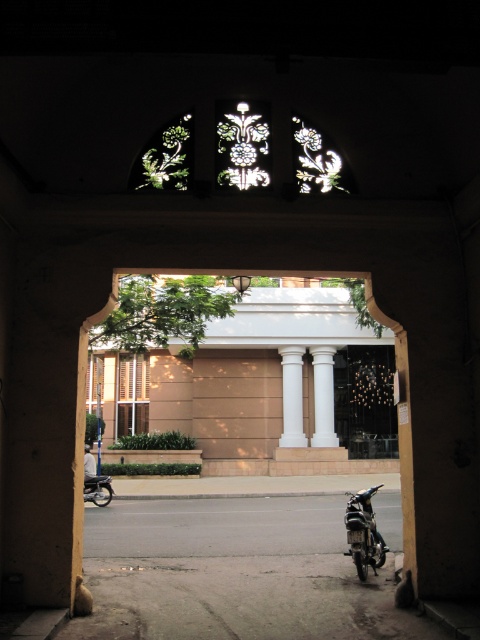
You are standing inside the arched doorway and want to walk towards the shiny black motorcycle at lower right and the shiny black motorcycle at lower left. Which motorcycle will you reach first?

You will reach the shiny black motorcycle at lower right first because it is closer to you than the shiny black motorcycle at lower left.

You are standing in a room with an arched doorway. You notice a white smooth column at center and a shiny black motorcycle at lower left. Which object is taller?

The white smooth column at center is taller than the shiny black motorcycle at lower left.

You are standing in a room and looking through an arched doorway. There is a white smooth column at center in your view. If you want to walk straight towards the column, which direction should you move relative to the doorway?

Since the white smooth column at center is located at coordinates point (291, 396), you should move straight forward through the doorway to reach it.